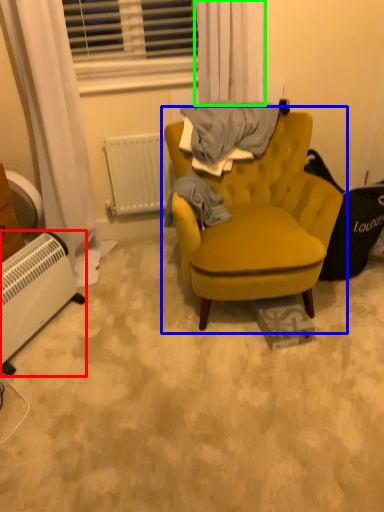
Question: Which is farther away from radiator (highlighted by a red box)? chair (highlighted by a blue box) or curtain (highlighted by a green box)?

Choices:
 (A) chair
 (B) curtain

Answer: (B)